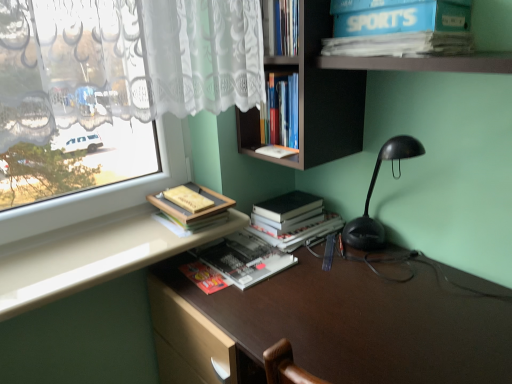
Question: From the image's perspective, is hardcover black book at center, positioned as the 3th book in top-to-bottom order, located beneath hardcover book at center, which appears as the 1th book when ordered from the bottom?

Choices:
 (A) no
 (B) yes

Answer: (A)

Question: Are hardcover black book at center, the 2th book from the bottom, and hardcover book at center, marked as the fourth book in a top-to-bottom arrangement, located far from each other?

Choices:
 (A) no
 (B) yes

Answer: (A)

Question: Is hardcover black book at center, positioned as the 3th book in top-to-bottom order, shorter than hardcover book at center, which appears as the 1th book when ordered from the bottom?

Choices:
 (A) no
 (B) yes

Answer: (A)

Question: Considering the relative sizes of hardcover black book at center, the 2th book from the bottom, and hardcover book at center, marked as the fourth book in a top-to-bottom arrangement, in the image provided, is hardcover black book at center, the 2th book from the bottom, bigger than hardcover book at center, marked as the fourth book in a top-to-bottom arrangement,?

Choices:
 (A) no
 (B) yes

Answer: (B)

Question: Is hardcover black book at center, positioned as the 3th book in top-to-bottom order, behind hardcover book at center, marked as the fourth book in a top-to-bottom arrangement?

Choices:
 (A) no
 (B) yes

Answer: (B)

Question: Relative to hardcover black book at center, the 2th book from the bottom, is hardcover book at center, which appears as the 1th book when ordered from the bottom, in front or behind?

Choices:
 (A) behind
 (B) front

Answer: (B)

Question: Considering the positions of hardcover book at center, which appears as the 1th book when ordered from the bottom, and hardcover black book at center, positioned as the 3th book in top-to-bottom order, in the image, is hardcover book at center, which appears as the 1th book when ordered from the bottom, bigger or smaller than hardcover black book at center, positioned as the 3th book in top-to-bottom order,?

Choices:
 (A) big
 (B) small

Answer: (B)

Question: Choose the correct answer: Is hardcover book at center, which appears as the 1th book when ordered from the bottom, inside hardcover black book at center, positioned as the 3th book in top-to-bottom order, or outside it?

Choices:
 (A) outside
 (B) inside

Answer: (A)

Question: From the image's perspective, is hardcover book at center, marked as the fourth book in a top-to-bottom arrangement, positioned above or below hardcover black book at center, the 2th book from the bottom?

Choices:
 (A) below
 (B) above

Answer: (A)

Question: In the image, is blue cardboard box at upper right on the left side or the right side of white glossy counter top at lower left?

Choices:
 (A) right
 (B) left

Answer: (A)

Question: In the image, is blue cardboard box at upper right positioned in front of or behind white glossy counter top at lower left?

Choices:
 (A) front
 (B) behind

Answer: (A)

Question: Is blue cardboard box at upper right inside or outside of white glossy counter top at lower left?

Choices:
 (A) outside
 (B) inside

Answer: (A)

Question: Looking at their shapes, would you say blue cardboard box at upper right is wider or thinner than white glossy counter top at lower left?

Choices:
 (A) wide
 (B) thin

Answer: (B)

Question: Considering the positions of white glossy counter top at lower left and hardcover books at center, the 1th book when ordered from top to bottom, in the image, is white glossy counter top at lower left taller or shorter than hardcover books at center, the 1th book when ordered from top to bottom,?

Choices:
 (A) short
 (B) tall

Answer: (A)

Question: Does point (31, 266) appear closer or farther from the camera than point (267, 140)?

Choices:
 (A) closer
 (B) farther

Answer: (A)